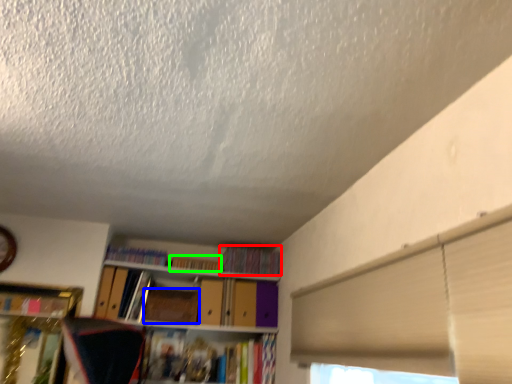
Question: Which object is the closest to the book (highlighted by a red box)? Choose among these: paperback book (highlighted by a blue box) or book (highlighted by a green box).

Choices:
 (A) paperback book
 (B) book

Answer: (B)